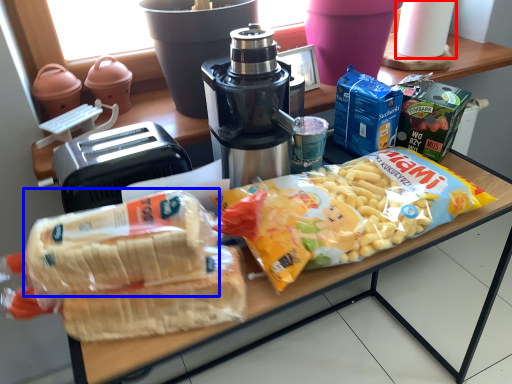
Question: Which object is closer to the camera taking this photo, paper towel (highlighted by a red box) or snack (highlighted by a blue box)?

Choices:
 (A) paper towel
 (B) snack

Answer: (B)